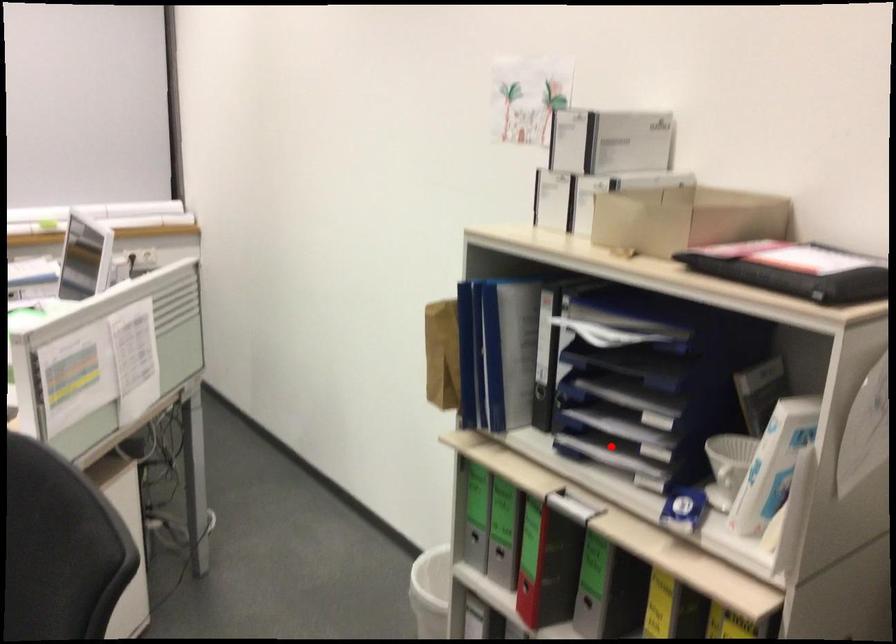
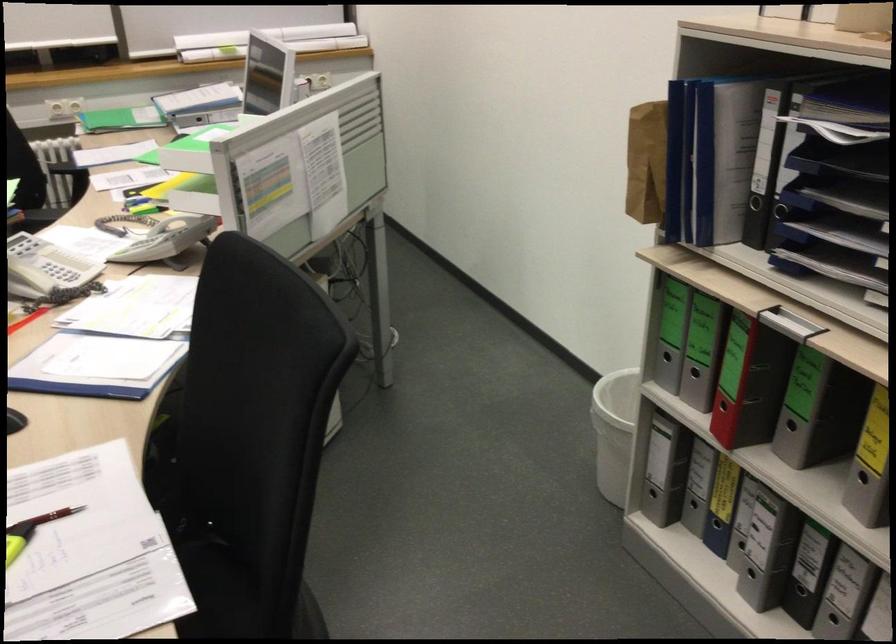
Where in the second image is the point corresponding to the highlighted location from the first image?

(833, 261)